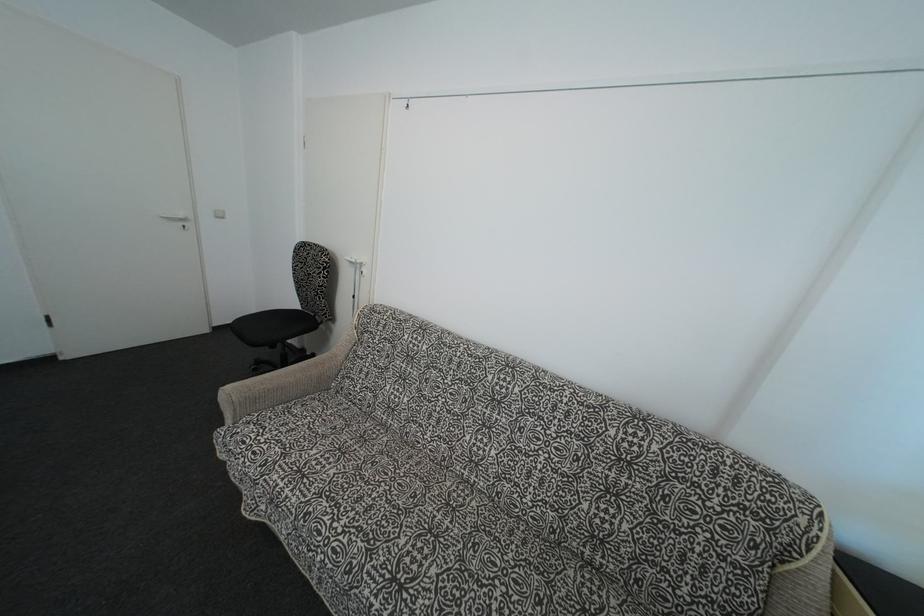
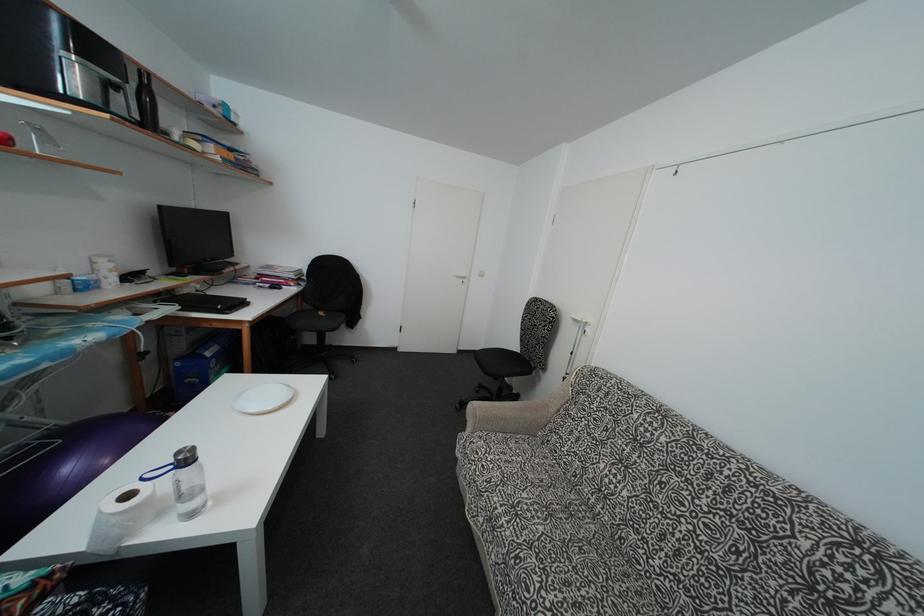
Locate, in the second image, the point that corresponds to (188,227) in the first image.

(468, 284)